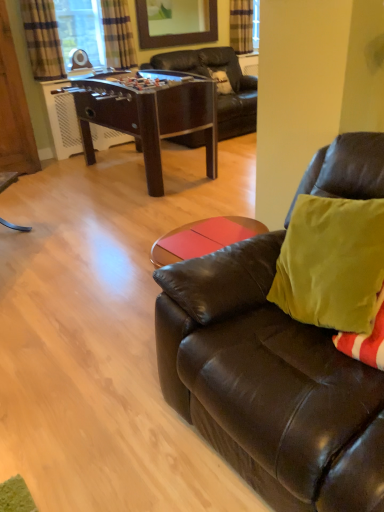
Question: Is wooden frame mirror at upper center completely or partially outside of wooden armoire at left?

Choices:
 (A) no
 (B) yes

Answer: (B)

Question: Could you tell me if wooden frame mirror at upper center is turned towards wooden armoire at left?

Choices:
 (A) yes
 (B) no

Answer: (B)

Question: Is wooden frame mirror at upper center to the right of wooden armoire at left from the viewer's perspective?

Choices:
 (A) yes
 (B) no

Answer: (A)

Question: Is wooden frame mirror at upper center at the left side of wooden armoire at left?

Choices:
 (A) yes
 (B) no

Answer: (B)

Question: Is wooden frame mirror at upper center next to wooden armoire at left?

Choices:
 (A) yes
 (B) no

Answer: (B)

Question: Is wooden frame mirror at upper center not close to wooden armoire at left?

Choices:
 (A) yes
 (B) no

Answer: (A)

Question: Would you say matte brown leather couch at right is outside wooden frame mirror at upper center?

Choices:
 (A) yes
 (B) no

Answer: (A)

Question: Is matte brown leather couch at right far away from wooden frame mirror at upper center?

Choices:
 (A) no
 (B) yes

Answer: (B)

Question: Considering the relative sizes of matte brown leather couch at right and wooden frame mirror at upper center in the image provided, is matte brown leather couch at right wider than wooden frame mirror at upper center?

Choices:
 (A) yes
 (B) no

Answer: (A)

Question: Is matte brown leather couch at right at the right side of wooden frame mirror at upper center?

Choices:
 (A) yes
 (B) no

Answer: (A)

Question: Is matte brown leather couch at right in front of wooden frame mirror at upper center?

Choices:
 (A) yes
 (B) no

Answer: (A)

Question: From a real-world perspective, is matte brown leather couch at right physically above wooden frame mirror at upper center?

Choices:
 (A) no
 (B) yes

Answer: (A)

Question: Can you confirm if wooden frame mirror at upper center is positioned to the right of plaid fabric curtain at upper left, the 2th curtain when ordered from back to front?

Choices:
 (A) no
 (B) yes

Answer: (B)